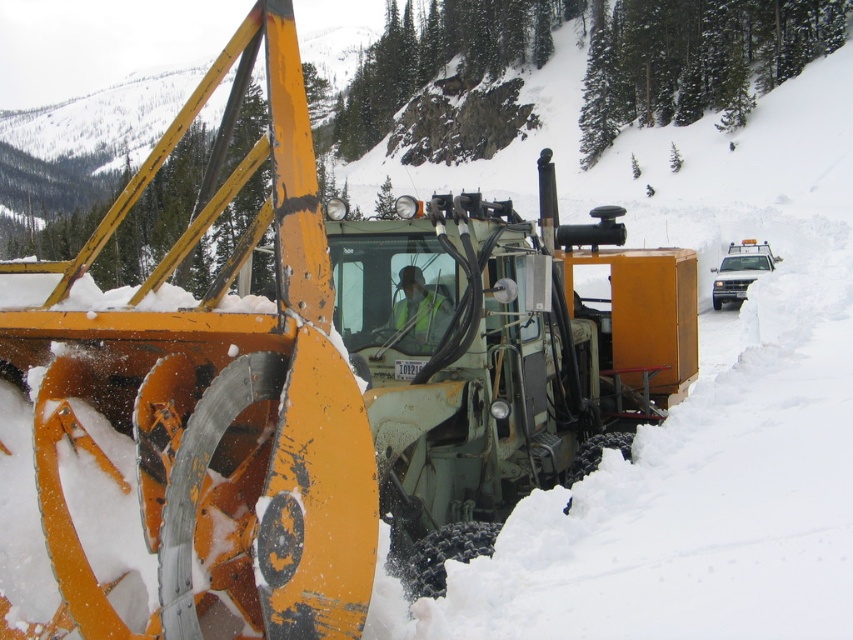
Is the position of reflective yellow safety vest at center less distant than that of matte yellow snowplow at center?

That is True.

Does point (409, 307) come farther from viewer compared to point (714, 300)?

No.

Is point (409, 298) positioned after point (714, 292)?

No, it is not.

Where is `reflective yellow safety vest at center`? This screenshot has height=640, width=853. reflective yellow safety vest at center is located at coordinates (419, 305).